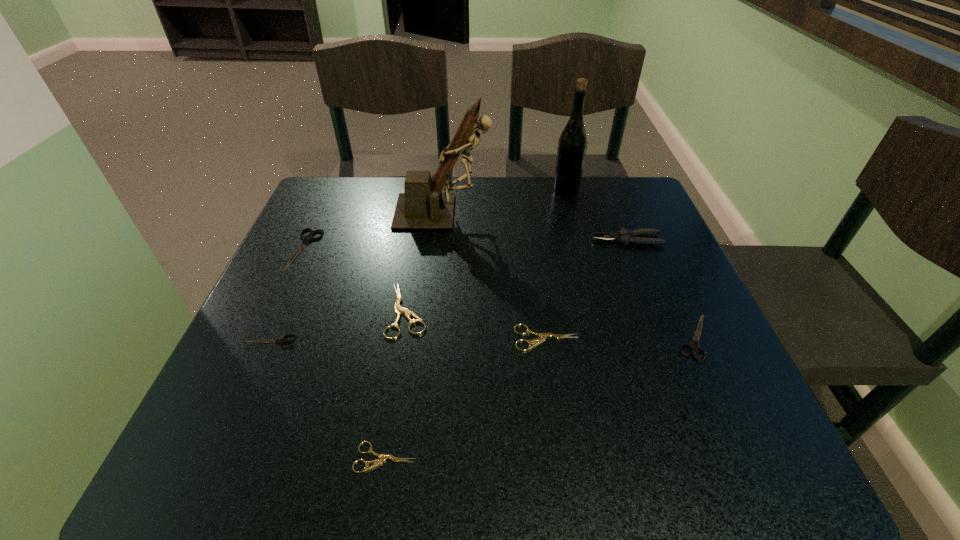
This screenshot has height=540, width=960. Identify the location of black shears that can be found as the third closest to the seventh shortest object. (282, 341).

Locate which beige shears ranks in proximity to the smallest black shears. Please provide its 2D coordinates. Your answer should be formatted as a tuple, i.e. [(x, y)], where the tuple contains the x and y coordinates of a point satisfying the conditions above.

[(399, 310)]

This screenshot has width=960, height=540. In order to click on the closest beige shears relative to the rightmost black shears in this screenshot , I will do `click(544, 336)`.

Image resolution: width=960 pixels, height=540 pixels. What are the coordinates of `free space in the image that satisfies the following two spatial constraints: 1. on the front-facing side of the figurine; 2. on the front side of the biggest beige shears` in the screenshot? It's located at (433, 310).

At what (x,y) coordinates should I click in order to perform the action: click on vacant space that satisfies the following two spatial constraints: 1. on the front side of the biggest black shears; 2. on the left side of the biggest beige shears. Please return your answer as a coordinate pair (x, y). The width and height of the screenshot is (960, 540). Looking at the image, I should click on (277, 310).

You are a GUI agent. You are given a task and a screenshot of the screen. Output one action in this format:
    pyautogui.click(x=<x>, y=<y>)
    Task: Click on the blank space that satisfies the following two spatial constraints: 1. on the front side of the second smallest black shears; 2. on the left side of the beer bottle
    
    Given the screenshot: What is the action you would take?
    pyautogui.click(x=605, y=337)